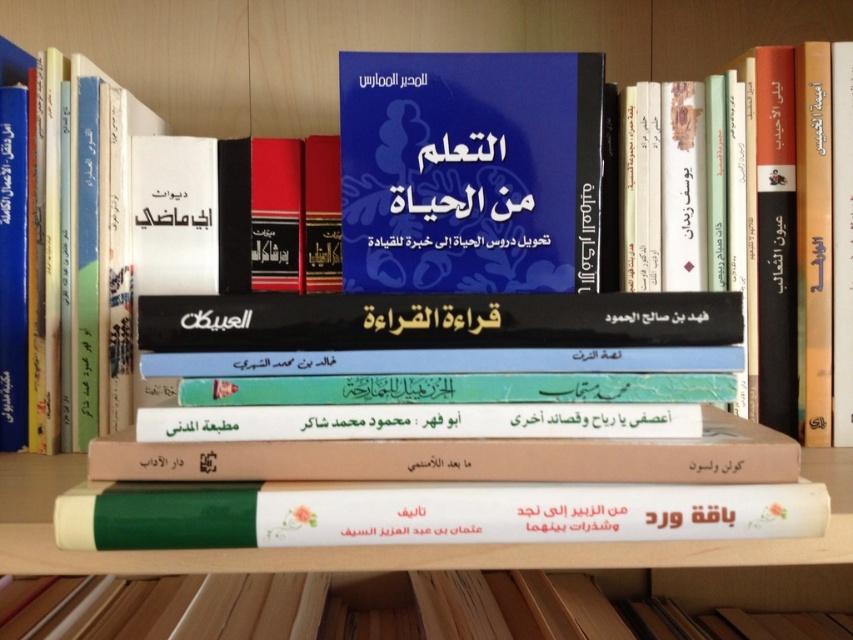
Looking at this image, you are organizing a bookshelf and need to place the green matte book at center and the white paper book at center. Which book should you place first to ensure proper stacking?

You should place the green matte book at center first because it is larger in size than the white paper book at center, allowing the smaller book to be stacked on top without overhanging.

You are a librarian organizing books on a shelf. You need to place a new book exactly at the coordinates point (469, 170). According to the image, what book is located at that point?

The blue matte book at center is located at point (469, 170).

You are standing in front of the bookshelf and want to reach two points marked on the shelf. The first point is at coordinates point (514, 99) and the second is at point (274, 525). Which point is closer to you?

Point (514, 99) is further to the viewer than point (274, 525), so the second point is closer to you.